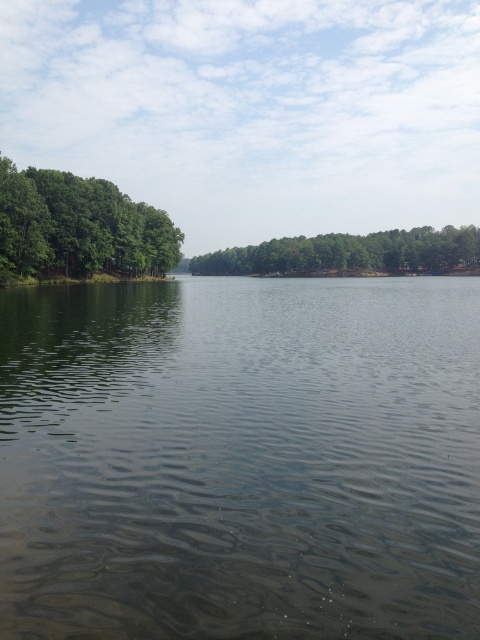
Does clear water at center have a greater width compared to green matte trees at center?

Incorrect, clear water at center's width does not surpass green matte trees at center's.

Who is more distant from viewer, (40,449) or (280,262)?

Point (280,262)

Who is more distant from viewer, (168, 512) or (400, 228)?

Point (400, 228)

Where is `clear water at center`? Image resolution: width=480 pixels, height=640 pixels. clear water at center is located at coordinates (240, 460).

Does clear water at center come behind green leafy trees at left?

No, it is not.

Is point (331, 529) positioned after point (6, 259)?

No, (331, 529) is closer to viewer.

You are a GUI agent. You are given a task and a screenshot of the screen. Output one action in this format:
    pyautogui.click(x=<x>, y=<y>)
    Task: Click on the clear water at center
    This screenshot has height=640, width=480.
    Given the screenshot: What is the action you would take?
    pyautogui.click(x=240, y=460)

Is point (94, 208) closer to camera compared to point (399, 243)?

Yes.

Between point (39, 220) and point (237, 257), which one is positioned behind?

The point (237, 257) is behind.

The image size is (480, 640). In order to click on green leafy trees at left in this screenshot , I will do `click(79, 227)`.